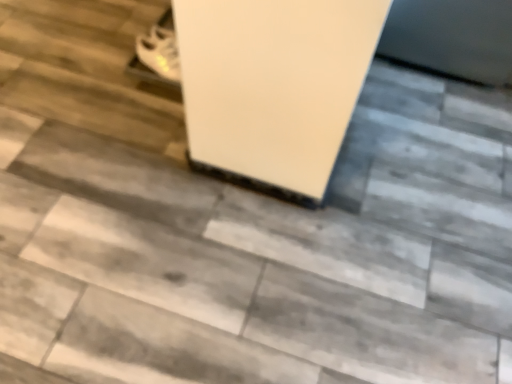
Image resolution: width=512 pixels, height=384 pixels. I want to click on white matte shoes at upper left, so click(159, 52).

The height and width of the screenshot is (384, 512). What do you see at coordinates (159, 52) in the screenshot?
I see `white matte shoes at upper left` at bounding box center [159, 52].

Where is `white matte shoes at upper left`? Image resolution: width=512 pixels, height=384 pixels. white matte shoes at upper left is located at coordinates (159, 52).